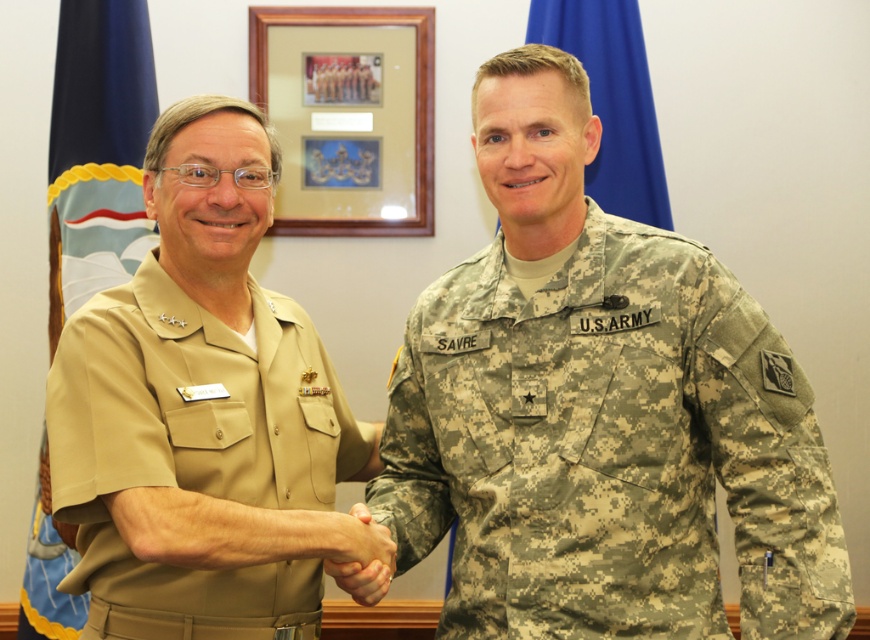
Question: Does blue fabric flag at left lie behind blue fabric flag at upper center?

Choices:
 (A) yes
 (B) no

Answer: (A)

Question: Among these objects, which one is farthest from the camera?

Choices:
 (A) blue fabric flag at left
 (B) camouflage fabric us army uniform at center
 (C) tan fabric uniform at left

Answer: (A)

Question: Which point appears closest to the camera in this image?

Choices:
 (A) 313,612
 (B) 634,90
 (C) 540,378

Answer: (C)

Question: Which of the following is the farthest from the observer?

Choices:
 (A) (482, 308)
 (B) (569, 4)
 (C) (241, 589)

Answer: (B)

Question: Can you confirm if camouflage fabric us army uniform at center is thinner than tan fabric uniform at left?

Choices:
 (A) yes
 (B) no

Answer: (B)

Question: Is blue fabric flag at left thinner than blue fabric flag at upper center?

Choices:
 (A) yes
 (B) no

Answer: (A)